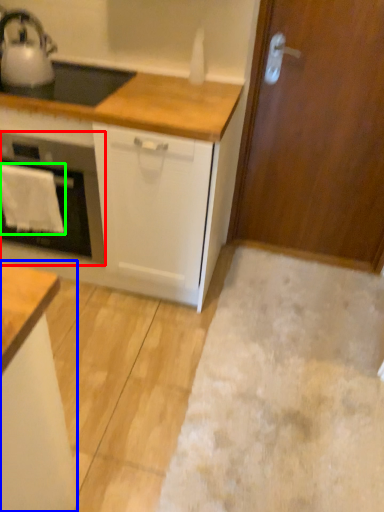
Question: Which object is positioned farthest from home appliance (highlighted by a red box)? Select from cabinetry (highlighted by a blue box) and cloth (highlighted by a green box).

Choices:
 (A) cabinetry
 (B) cloth

Answer: (A)